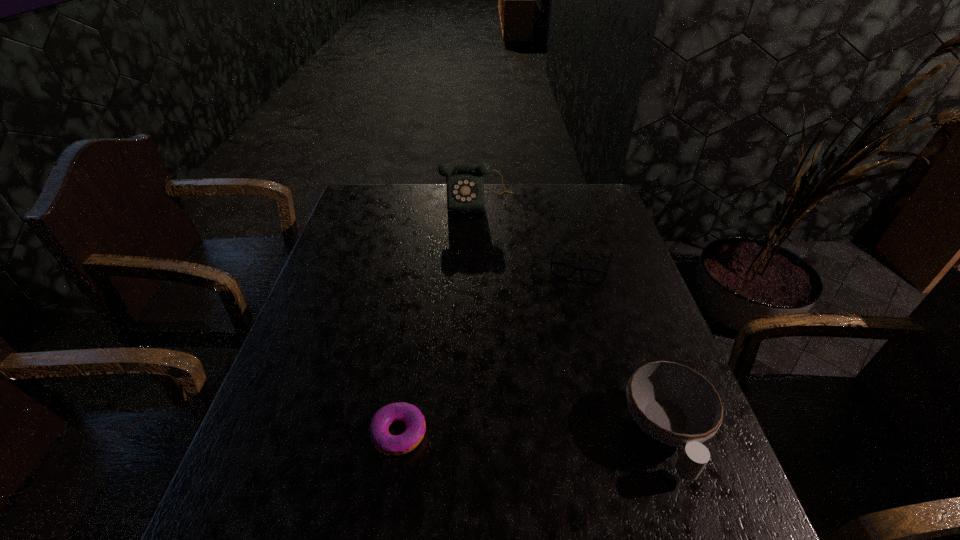
You are a GUI agent. You are given a task and a screenshot of the screen. Output one action in this format:
    pyautogui.click(x=<x>, y=<y>)
    Task: Click on the shortest object
    The image size is (960, 540).
    Given the screenshot: What is the action you would take?
    point(394,445)

Locate an element on the screen. The width and height of the screenshot is (960, 540). chinaware is located at coordinates (674, 404).

At what (x,y) coordinates should I click in order to perform the action: click on spectacles. Please return your answer as a coordinate pair (x, y). This screenshot has width=960, height=540. Looking at the image, I should click on (562, 270).

Identify the location of the third tallest object. This screenshot has height=540, width=960. (562, 270).

You are a GUI agent. You are given a task and a screenshot of the screen. Output one action in this format:
    pyautogui.click(x=<x>, y=<y>)
    Task: Click on the tallest object
    The width and height of the screenshot is (960, 540).
    Given the screenshot: What is the action you would take?
    pyautogui.click(x=465, y=186)

Where is `telephone`? telephone is located at coordinates (465, 186).

The image size is (960, 540). Find the location of `free space located 0.070m on the right of the shortest object`. free space located 0.070m on the right of the shortest object is located at coordinates (462, 433).

This screenshot has height=540, width=960. Identify the location of vacant space located on the front-facing side of the spectacles. (569, 310).

This screenshot has height=540, width=960. I want to click on free space located on the front-facing side of the spectacles, so click(560, 353).

Identify the location of vacant area situated on the front-facing side of the spectacles. The width and height of the screenshot is (960, 540). (573, 298).